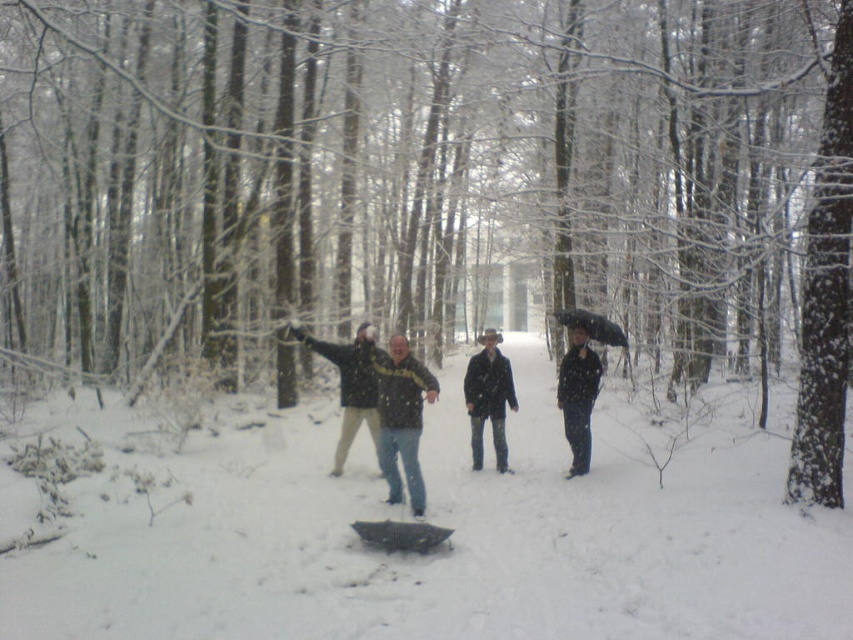
In the snowy forest scene, there are two people wearing jackets. One has a matte black jacket at center and the other has a black matte jacket at center. Which jacket is wider?

The matte black jacket at center is wider than the black matte jacket at center.

You are one of the people in the snowy forest scene. You notice the white fluffy snow at center and the dark blue jeans at center. Based on their positions, which one is closer to you?

The white fluffy snow at center is closer to you because it is in front of the dark blue jeans at center.